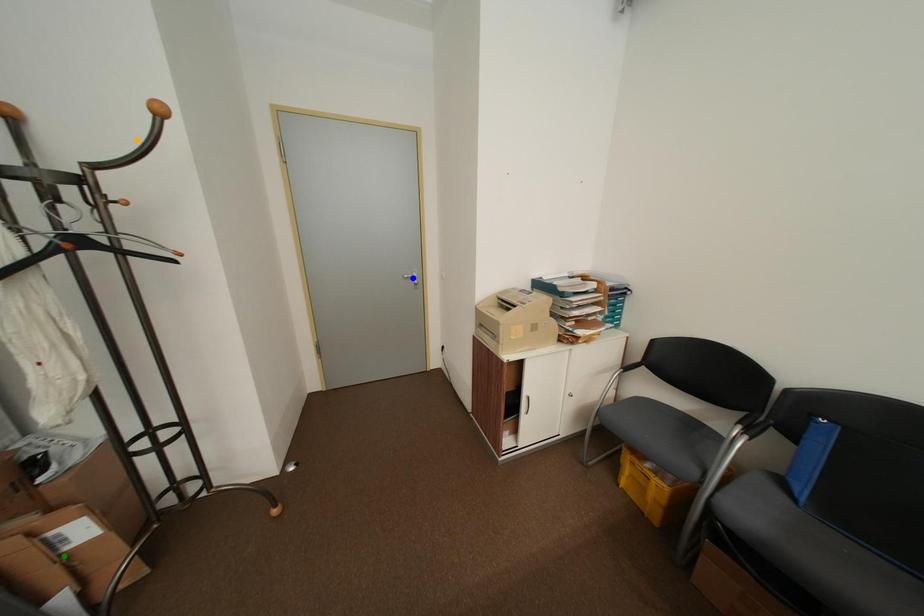
Order these from nearest to farthest:
A) orange point
B) blue point
C) green point

blue point → orange point → green point